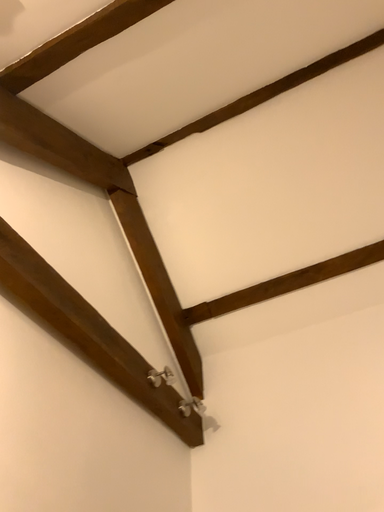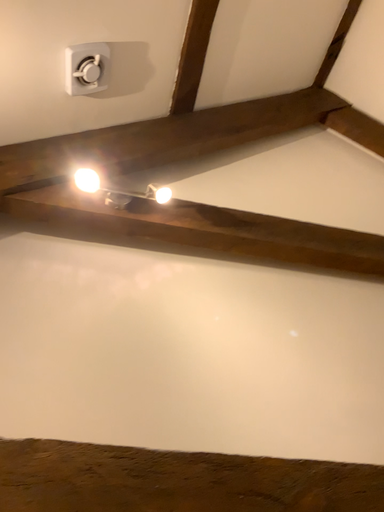
Question: How did the camera likely rotate when shooting the video?

Choices:
 (A) rotated upward
 (B) rotated downward

Answer: (B)